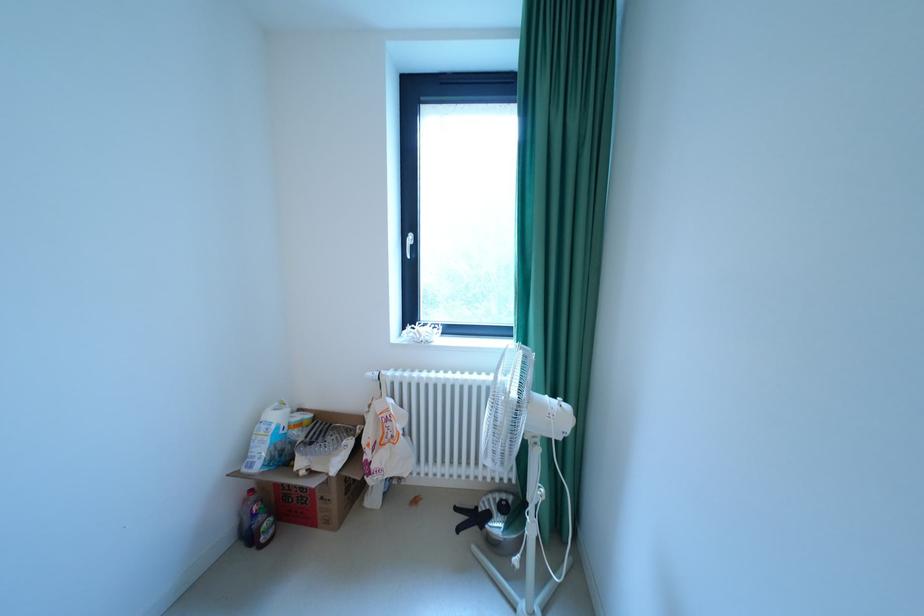
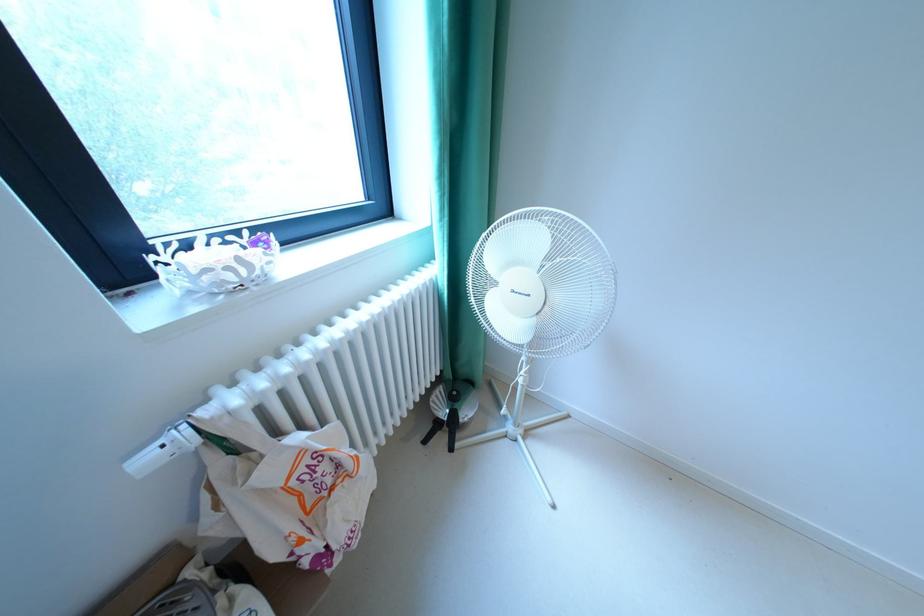
The point at (432, 339) is marked in the first image. Where is the corresponding point in the second image?

(268, 273)